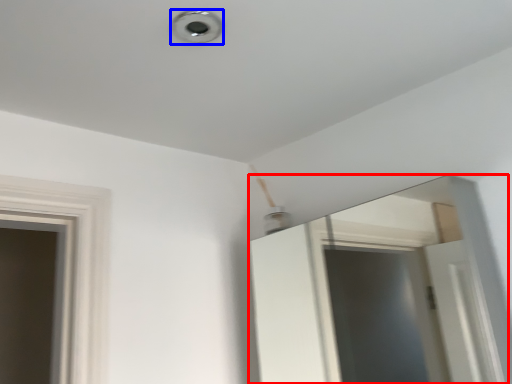
Question: Among these objects, which one is nearest to the camera, mirror (highlighted by a red box) or light (highlighted by a blue box)?

Choices:
 (A) mirror
 (B) light

Answer: (A)